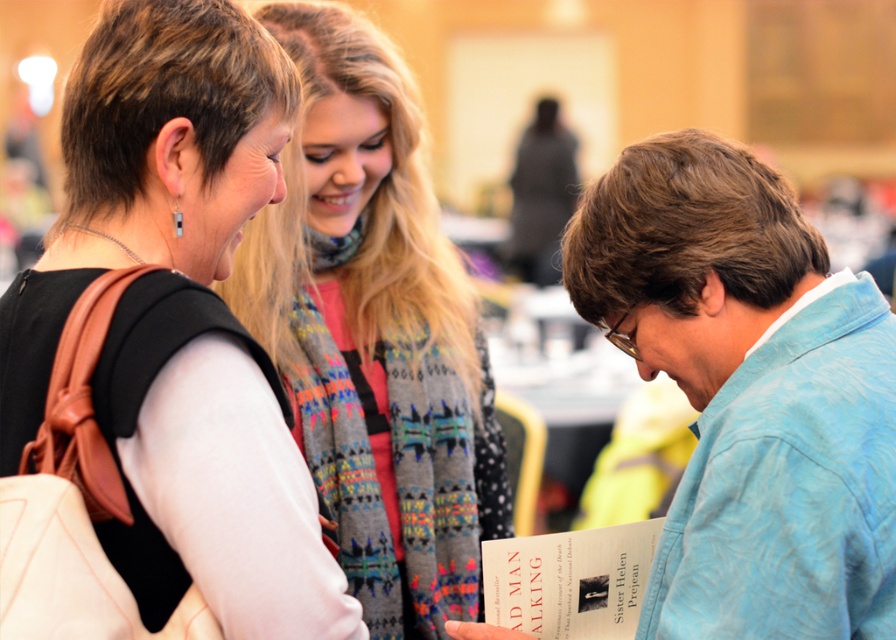
Question: Is matte black top at upper left to the right of matte paper book at lower right from the viewer's perspective?

Choices:
 (A) no
 (B) yes

Answer: (A)

Question: Among these objects, which one is nearest to the camera?

Choices:
 (A) matte paper book at lower right
 (B) white sweater at center
 (C) blue textured shirt at lower right
 (D) matte black top at upper left

Answer: (D)

Question: Which point is farther from the camera taking this photo?

Choices:
 (A) (362, 358)
 (B) (549, 604)
 (C) (854, 278)
 (D) (202, 461)

Answer: (A)

Question: Which is nearer to the white sweater at center?

Choices:
 (A) blue textured shirt at lower right
 (B) matte paper book at lower right
 (C) matte black top at upper left

Answer: (B)

Question: Does blue textured shirt at lower right appear on the right side of matte paper book at lower right?

Choices:
 (A) yes
 (B) no

Answer: (A)

Question: Does matte black top at upper left come behind blue textured shirt at lower right?

Choices:
 (A) yes
 (B) no

Answer: (B)